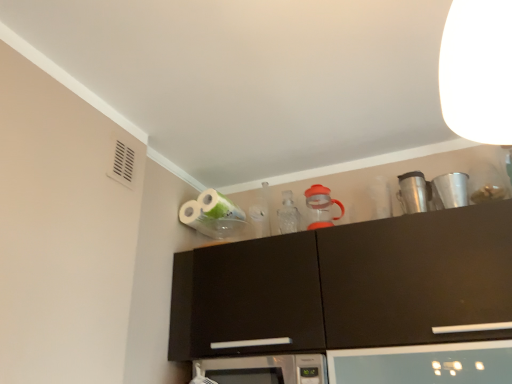
This screenshot has height=384, width=512. Describe the element at coordinates (321, 207) in the screenshot. I see `orange plastic pitcher at upper center, the 3th appliance viewed from the right` at that location.

This screenshot has height=384, width=512. What do you see at coordinates (209, 208) in the screenshot? I see `white glossy toilet paper at upper center` at bounding box center [209, 208].

The width and height of the screenshot is (512, 384). Describe the element at coordinates (450, 190) in the screenshot. I see `metallic silver cup at upper right, the 1th appliance when ordered from right to left` at that location.

You are a GUI agent. You are given a task and a screenshot of the screen. Output one action in this format:
    pyautogui.click(x=<x>, y=<y>)
    Task: Click on the orange plastic pitcher at upper center, which is the first appliance in left-to-right order
    The height and width of the screenshot is (384, 512).
    Given the screenshot: What is the action you would take?
    pyautogui.click(x=321, y=207)

From the image's perspective, would you say shiny metallic coffee cup at upper right, the 2th appliance in the left-to-right sequence, is positioned over metallic silver cup at upper right, the 1th appliance when ordered from right to left?

Actually, shiny metallic coffee cup at upper right, the 2th appliance in the left-to-right sequence, appears below metallic silver cup at upper right, the 1th appliance when ordered from right to left, in the image.

Does point (410, 212) appear closer or farther from the camera than point (446, 180)?

Point (410, 212) is farther from the camera than point (446, 180).

From the picture: Is shiny metallic coffee cup at upper right, the 2th appliance in the left-to-right sequence, taller than metallic silver cup at upper right, the 1th appliance when ordered from right to left?

Indeed, shiny metallic coffee cup at upper right, the 2th appliance in the left-to-right sequence, has a greater height compared to metallic silver cup at upper right, the 1th appliance when ordered from right to left.

How many degrees apart are the facing directions of shiny metallic coffee cup at upper right, positioned as the 2th appliance in right-to-left order, and metallic silver cup at upper right, the 1th appliance when ordered from right to left?

There is a 0.971-degree angle between the facing directions of shiny metallic coffee cup at upper right, positioned as the 2th appliance in right-to-left order, and metallic silver cup at upper right, the 1th appliance when ordered from right to left.

Which is more to the left, shiny metallic coffee cup at upper right, the 2th appliance in the left-to-right sequence, or white glossy toilet paper at upper center?

Positioned to the left is white glossy toilet paper at upper center.

Is shiny metallic coffee cup at upper right, the 2th appliance in the left-to-right sequence, inside the boundaries of white glossy toilet paper at upper center, or outside?

shiny metallic coffee cup at upper right, the 2th appliance in the left-to-right sequence, cannot be found inside white glossy toilet paper at upper center.

Is shiny metallic coffee cup at upper right, the 2th appliance in the left-to-right sequence, oriented away from white glossy toilet paper at upper center?

No, shiny metallic coffee cup at upper right, the 2th appliance in the left-to-right sequence, is not facing away from white glossy toilet paper at upper center.

Between shiny metallic coffee cup at upper right, the 2th appliance in the left-to-right sequence, and white glossy toilet paper at upper center, which one has larger width?

Wider between the two is white glossy toilet paper at upper center.

Which is nearer, (403, 193) or (308, 203)?

Point (403, 193).

Are shiny metallic coffee cup at upper right, the 2th appliance in the left-to-right sequence, and orange plastic pitcher at upper center, the 3th appliance viewed from the right, located far from each other?

Actually, shiny metallic coffee cup at upper right, the 2th appliance in the left-to-right sequence, and orange plastic pitcher at upper center, the 3th appliance viewed from the right, are a little close together.

How different are the orientations of shiny metallic coffee cup at upper right, the 2th appliance in the left-to-right sequence, and orange plastic pitcher at upper center, which is the first appliance in left-to-right order, in degrees?

shiny metallic coffee cup at upper right, the 2th appliance in the left-to-right sequence, and orange plastic pitcher at upper center, which is the first appliance in left-to-right order, are facing 4.24 degrees away from each other.

Which object is positioned more to the right, shiny metallic coffee cup at upper right, the 2th appliance in the left-to-right sequence, or orange plastic pitcher at upper center, the 3th appliance viewed from the right?

shiny metallic coffee cup at upper right, the 2th appliance in the left-to-right sequence.

Is silver metallic microwave at center positioned beyond the bounds of shiny metallic coffee cup at upper right, positioned as the 2th appliance in right-to-left order?

Indeed, silver metallic microwave at center is completely outside shiny metallic coffee cup at upper right, positioned as the 2th appliance in right-to-left order.

Considering the sizes of silver metallic microwave at center and shiny metallic coffee cup at upper right, the 2th appliance in the left-to-right sequence, in the image, is silver metallic microwave at center taller or shorter than shiny metallic coffee cup at upper right, the 2th appliance in the left-to-right sequence,?

silver metallic microwave at center is shorter than shiny metallic coffee cup at upper right, the 2th appliance in the left-to-right sequence.

Which is farther from the camera, (312,373) or (422,210)?

Positioned behind is point (422,210).

From a real-world perspective, is silver metallic microwave at center over shiny metallic coffee cup at upper right, the 2th appliance in the left-to-right sequence?

Incorrect, from a real-world perspective, silver metallic microwave at center is lower than shiny metallic coffee cup at upper right, the 2th appliance in the left-to-right sequence.

Is orange plastic pitcher at upper center, the 3th appliance viewed from the right, at the right side of silver metallic microwave at center?

Yes, orange plastic pitcher at upper center, the 3th appliance viewed from the right, is to the right of silver metallic microwave at center.

Which is in front, point (321, 219) or point (222, 370)?

The point (222, 370) is more forward.

Locate an element on the screen. microwave oven in front of the orange plastic pitcher at upper center, which is the first appliance in left-to-right order is located at coordinates (263, 369).

Which object is more forward, orange plastic pitcher at upper center, which is the first appliance in left-to-right order, or silver metallic microwave at center?

silver metallic microwave at center.

Does orange plastic pitcher at upper center, the 3th appliance viewed from the right, have a lesser width compared to shiny metallic coffee cup at upper right, the 2th appliance in the left-to-right sequence?

Yes, orange plastic pitcher at upper center, the 3th appliance viewed from the right, is thinner than shiny metallic coffee cup at upper right, the 2th appliance in the left-to-right sequence.

Is orange plastic pitcher at upper center, the 3th appliance viewed from the right, facing away from shiny metallic coffee cup at upper right, positioned as the 2th appliance in right-to-left order?

orange plastic pitcher at upper center, the 3th appliance viewed from the right, is not turned away from shiny metallic coffee cup at upper right, positioned as the 2th appliance in right-to-left order.

From the image's perspective, relative to shiny metallic coffee cup at upper right, the 2th appliance in the left-to-right sequence, is orange plastic pitcher at upper center, which is the first appliance in left-to-right order, above or below?

Based on their image positions, orange plastic pitcher at upper center, which is the first appliance in left-to-right order, is located beneath shiny metallic coffee cup at upper right, the 2th appliance in the left-to-right sequence.

Between orange plastic pitcher at upper center, the 3th appliance viewed from the right, and shiny metallic coffee cup at upper right, the 2th appliance in the left-to-right sequence, which one appears on the left side from the viewer's perspective?

From the viewer's perspective, orange plastic pitcher at upper center, the 3th appliance viewed from the right, appears more on the left side.

Would you say white glossy toilet paper at upper center is to the left or to the right of metallic silver cup at upper right, the 1th appliance when ordered from right to left, in the picture?

In the image, white glossy toilet paper at upper center appears on the left side of metallic silver cup at upper right, the 1th appliance when ordered from right to left.

Where is `toilet paper above the metallic silver cup at upper right, the 1th appliance when ordered from right to left (from a real-world perspective)`? The width and height of the screenshot is (512, 384). toilet paper above the metallic silver cup at upper right, the 1th appliance when ordered from right to left (from a real-world perspective) is located at coordinates (209, 208).

Does white glossy toilet paper at upper center have a greater height compared to metallic silver cup at upper right, the 1th appliance when ordered from right to left?

Yes.

Is white glossy toilet paper at upper center facing towards metallic silver cup at upper right, the 1th appliance when ordered from right to left?

No, white glossy toilet paper at upper center is not facing towards metallic silver cup at upper right, the 1th appliance when ordered from right to left.

Where is `appliance located on the right of shiny metallic coffee cup at upper right, the 2th appliance in the left-to-right sequence`? The image size is (512, 384). appliance located on the right of shiny metallic coffee cup at upper right, the 2th appliance in the left-to-right sequence is located at coordinates (450, 190).

Identify the location of toilet paper above the shiny metallic coffee cup at upper right, positioned as the 2th appliance in right-to-left order (from a real-world perspective). tap(209, 208).

Which object lies nearer to the anchor point orange plastic pitcher at upper center, the 3th appliance viewed from the right, shiny metallic coffee cup at upper right, the 2th appliance in the left-to-right sequence, or metallic silver cup at upper right, acting as the third appliance starting from the left?

shiny metallic coffee cup at upper right, the 2th appliance in the left-to-right sequence, is closer to orange plastic pitcher at upper center, the 3th appliance viewed from the right.

From the image, which object appears to be nearer to white glossy toilet paper at upper center, silver metallic microwave at center or orange plastic pitcher at upper center, the 3th appliance viewed from the right?

orange plastic pitcher at upper center, the 3th appliance viewed from the right, is closer to white glossy toilet paper at upper center.

Which object lies further to the anchor point white glossy toilet paper at upper center, silver metallic microwave at center or shiny metallic coffee cup at upper right, the 2th appliance in the left-to-right sequence?

shiny metallic coffee cup at upper right, the 2th appliance in the left-to-right sequence, is further to white glossy toilet paper at upper center.

Considering their positions, is silver metallic microwave at center positioned closer to metallic silver cup at upper right, acting as the third appliance starting from the left, than white glossy toilet paper at upper center?

silver metallic microwave at center.

Considering their positions, is shiny metallic coffee cup at upper right, the 2th appliance in the left-to-right sequence, positioned closer to white glossy toilet paper at upper center than metallic silver cup at upper right, the 1th appliance when ordered from right to left?

shiny metallic coffee cup at upper right, the 2th appliance in the left-to-right sequence.

Based on their spatial positions, is orange plastic pitcher at upper center, the 3th appliance viewed from the right, or shiny metallic coffee cup at upper right, the 2th appliance in the left-to-right sequence, closer to metallic silver cup at upper right, the 1th appliance when ordered from right to left?

shiny metallic coffee cup at upper right, the 2th appliance in the left-to-right sequence, lies closer to metallic silver cup at upper right, the 1th appliance when ordered from right to left, than the other object.

Looking at the image, which one is located closer to orange plastic pitcher at upper center, which is the first appliance in left-to-right order, shiny metallic coffee cup at upper right, the 2th appliance in the left-to-right sequence, or silver metallic microwave at center?

Among the two, shiny metallic coffee cup at upper right, the 2th appliance in the left-to-right sequence, is located nearer to orange plastic pitcher at upper center, which is the first appliance in left-to-right order.

In the scene shown: Considering their positions, is silver metallic microwave at center positioned closer to orange plastic pitcher at upper center, which is the first appliance in left-to-right order, than white glossy toilet paper at upper center?

white glossy toilet paper at upper center.

Identify the location of microwave oven located between white glossy toilet paper at upper center and shiny metallic coffee cup at upper right, the 2th appliance in the left-to-right sequence, in the left-right direction. The height and width of the screenshot is (384, 512). (263, 369).

What are the coordinates of `appliance between orange plastic pitcher at upper center, the 3th appliance viewed from the right, and metallic silver cup at upper right, the 1th appliance when ordered from right to left, from left to right` in the screenshot? It's located at (413, 192).

Where is `appliance between shiny metallic coffee cup at upper right, the 2th appliance in the left-to-right sequence, and silver metallic microwave at center in the up-down direction`? appliance between shiny metallic coffee cup at upper right, the 2th appliance in the left-to-right sequence, and silver metallic microwave at center in the up-down direction is located at coordinates (321, 207).

You are a GUI agent. You are given a task and a screenshot of the screen. Output one action in this format:
    pyautogui.click(x=<x>, y=<y>)
    Task: Click on the appliance located between white glossy toilet paper at upper center and shiny metallic coffee cup at upper right, positioned as the 2th appliance in right-to-left order, in the left-right direction
    The width and height of the screenshot is (512, 384).
    Given the screenshot: What is the action you would take?
    pyautogui.click(x=321, y=207)